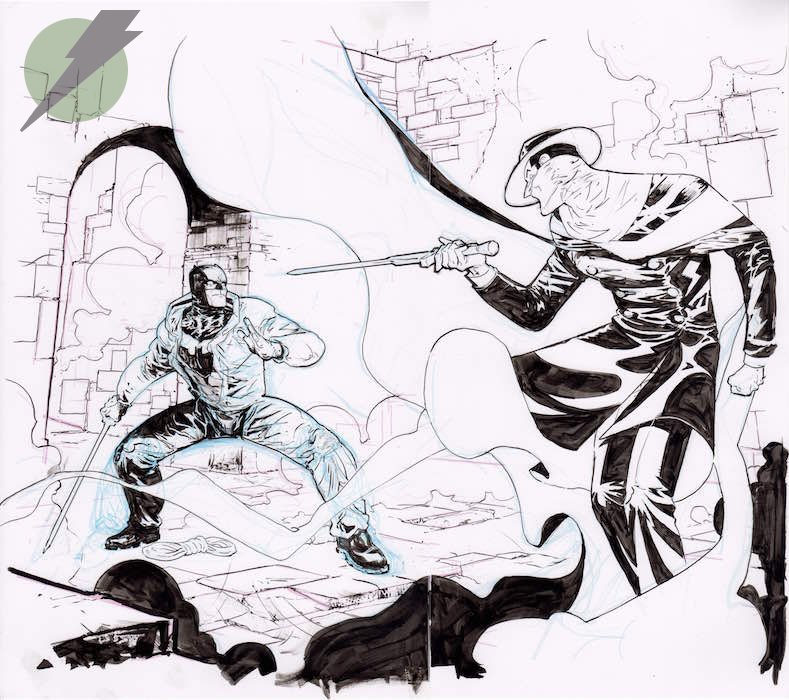
Find the location of a particular element. arch dooryway is located at coordinates (165, 140).